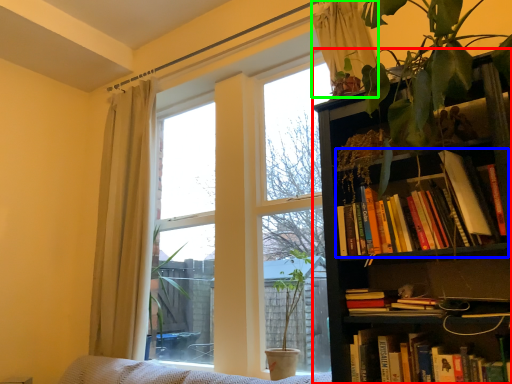
Question: Considering the real-world distances, which object is farthest from bookcase (highlighted by a red box)? book (highlighted by a blue box) or curtain (highlighted by a green box)?

Choices:
 (A) book
 (B) curtain

Answer: (B)